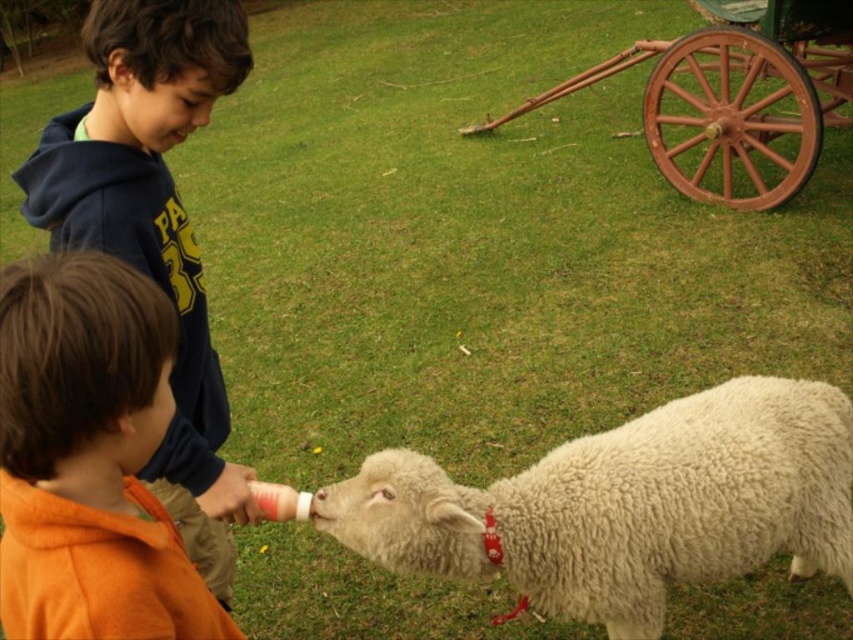
Based on the scene description, what is the 2D coordinate of the orange fleece jacket at lower left?

The orange fleece jacket at lower left is located at the 2D coordinate point of (90, 458).

You are a photographer trying to capture a clear photo of the rusty wood wagon at upper right. However, the white fluffy sheep at lower center is blocking your view. Can you move the sheep to the side to get an unobstructed shot?

The white fluffy sheep at lower center is in front of the rusty wood wagon at upper right, so moving the sheep to the side would allow you to see the wagon without obstruction.